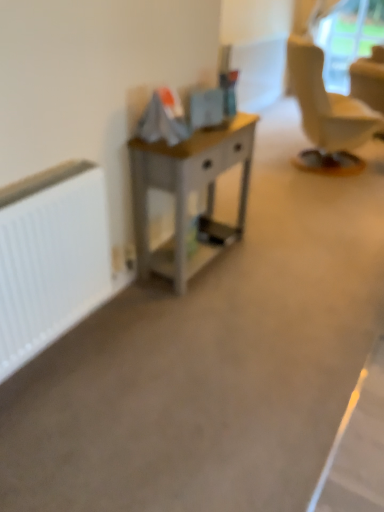
This screenshot has height=512, width=384. I want to click on free space in front of wooden desk at center, so click(x=206, y=312).